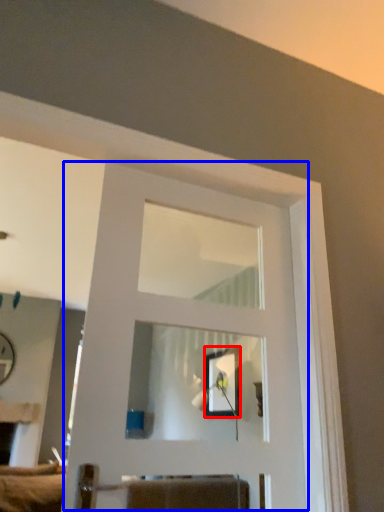
Question: Which object is closer to the camera taking this photo, picture frame (highlighted by a red box) or door (highlighted by a blue box)?

Choices:
 (A) picture frame
 (B) door

Answer: (B)